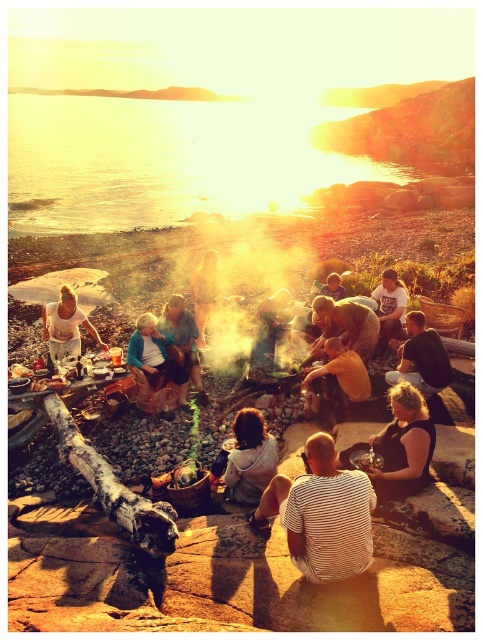
You are a photographer trying to capture the sunset scene. You notice the golden reflective water at upper center and the dark brown leather jacket at center. Which object appears taller in the photo?

The golden reflective water at upper center appears taller than the dark brown leather jacket at center in the photo because it has a greater height compared to it.

You are a photographer trying to capture the golden reflective water at upper center and the black fabric woman at center. Based on their positions, which object should you adjust your camera to focus on first if you want to include both in the frame without moving the camera?

The golden reflective water at upper center is to the left of the black fabric woman at center. Since the water is positioned to the left, you should first focus on the golden reflective water at upper center to ensure both are in frame.